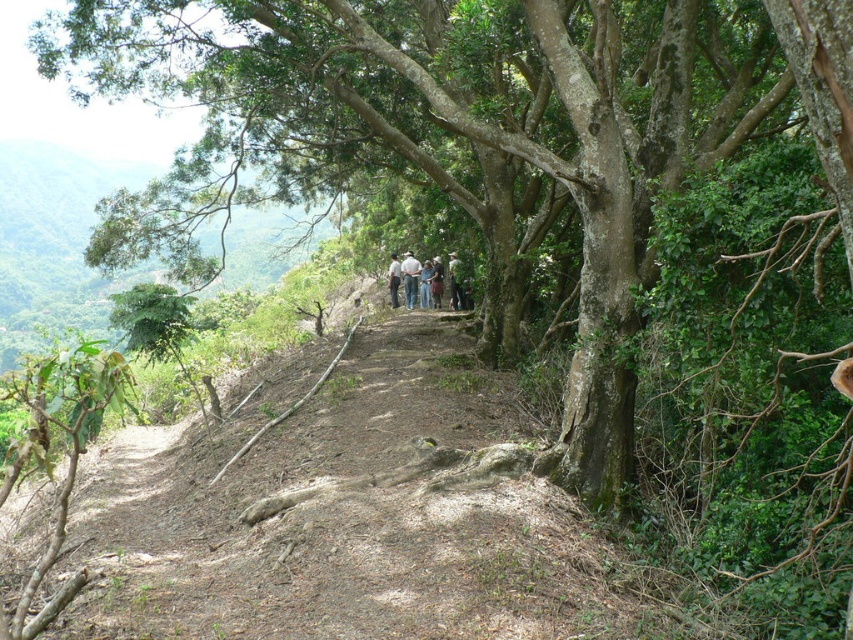
Which of these two, dark gray shirt at center or white cotton shirt at center, stands shorter?

With less height is dark gray shirt at center.

Is dark gray shirt at center closer to the viewer compared to white cotton shirt at center?

That is False.

Image resolution: width=853 pixels, height=640 pixels. I want to click on dark gray shirt at center, so click(422, 280).

The width and height of the screenshot is (853, 640). Find the location of `dark gray shirt at center`. dark gray shirt at center is located at coordinates coord(422,280).

Does dark gray shirt at center have a lesser width compared to light brown leather jacket at center?

No.

Locate an element on the screen. dark gray shirt at center is located at coordinates tap(422, 280).

Is point (444, 275) positioned behind point (451, 252)?

Yes, point (444, 275) is farther from viewer.

Based on the photo, is dark gray shirt at center positioned behind white fabric shirt at center?

Yes, dark gray shirt at center is further from the viewer.

What do you see at coordinates (422, 280) in the screenshot? I see `dark gray shirt at center` at bounding box center [422, 280].

This screenshot has width=853, height=640. I want to click on dark gray shirt at center, so click(x=422, y=280).